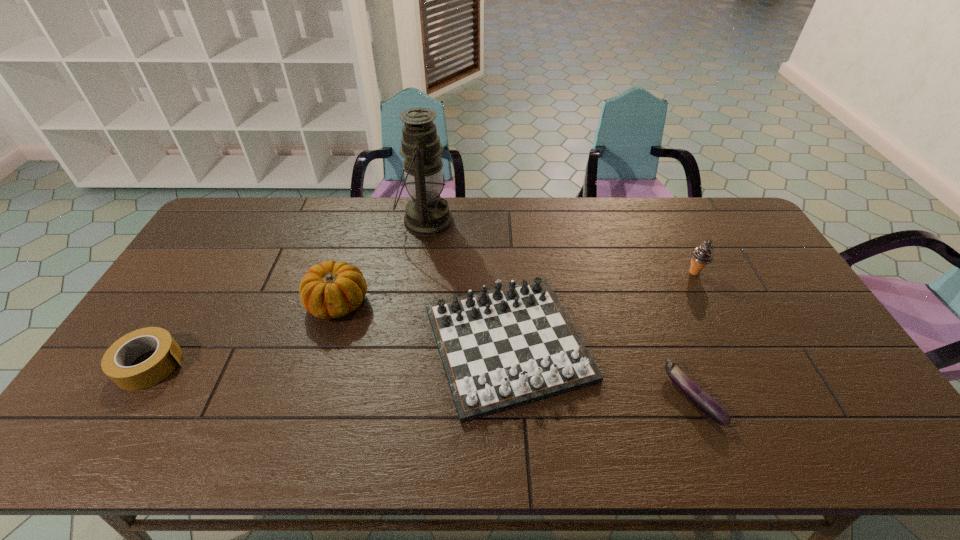
At what (x,y) coordinates should I click in order to perform the action: click on object present at the left edge. Please return your answer as a coordinate pair (x, y). Looking at the image, I should click on (116, 363).

Locate an element on the screen. The height and width of the screenshot is (540, 960). free space at the far edge of the desktop is located at coordinates (462, 237).

I want to click on vacant space at the near edge of the desktop, so click(252, 438).

Locate an element on the screen. vacant space at the left edge of the desktop is located at coordinates (230, 250).

In order to click on vacant region at the right edge of the desktop in this screenshot , I will do `click(773, 279)`.

Image resolution: width=960 pixels, height=540 pixels. I want to click on vacant space at the far left corner of the desktop, so click(213, 225).

Where is `free location at the far right corner`? The image size is (960, 540). free location at the far right corner is located at coordinates (732, 202).

This screenshot has height=540, width=960. In order to click on vacant area between the second object from right to left and the rightmost object in this screenshot , I will do `click(693, 334)`.

Where is `free area in between the oil lamp and the fifth nearest object`? free area in between the oil lamp and the fifth nearest object is located at coordinates (560, 247).

Find the location of a particular element. This screenshot has height=540, width=960. free spot between the oil lamp and the duct tape is located at coordinates (288, 293).